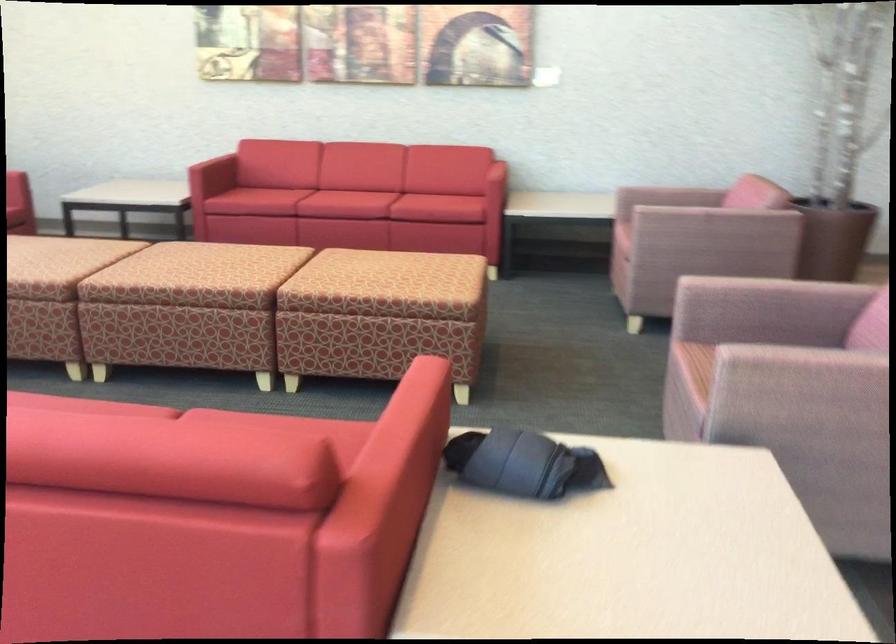
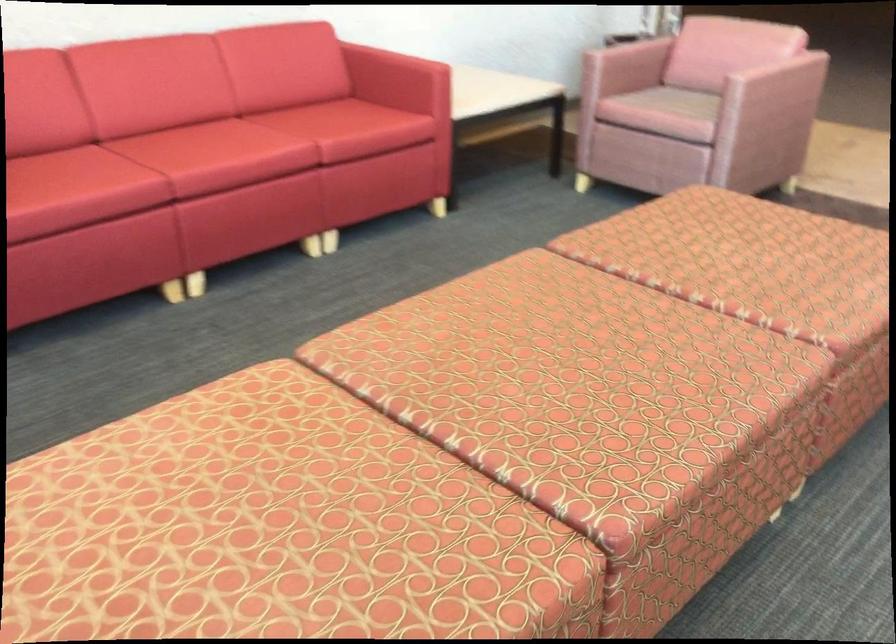
The point at (409, 263) is marked in the first image. Where is the corresponding point in the second image?

(762, 245)